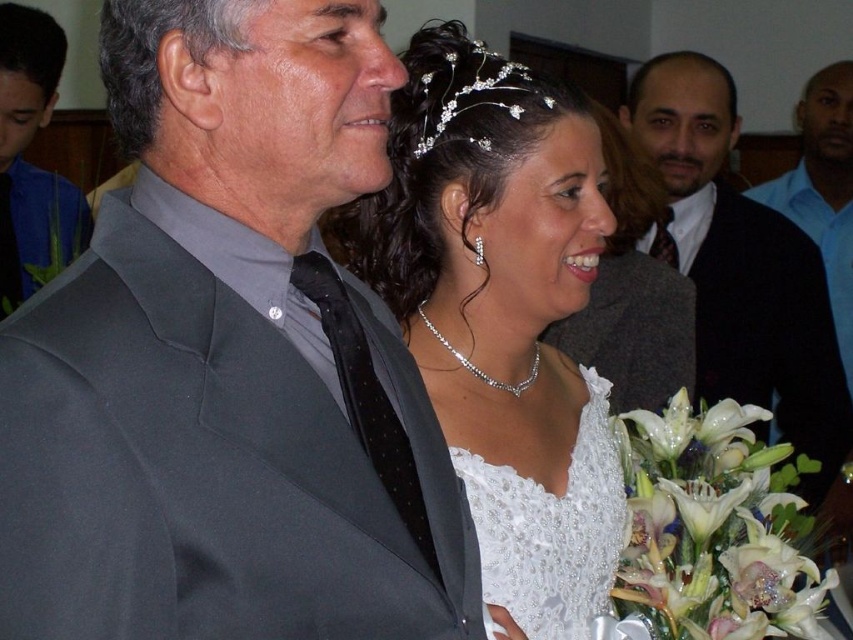
Question: Among these objects, which one is farthest from the camera?

Choices:
 (A) matte gray suit at left
 (B) smooth skin forehead at upper center
 (C) blue shirt at upper right
 (D) white satin dress at center

Answer: (C)

Question: Can you confirm if matte black suit at upper left is positioned to the right of matte gray suit at left?

Choices:
 (A) no
 (B) yes

Answer: (B)

Question: Does dark brown skin at upper right lie behind smooth skin face at upper left?

Choices:
 (A) yes
 (B) no

Answer: (B)

Question: Which point is farther from the camera taking this photo?

Choices:
 (A) (421, 259)
 (B) (819, 276)
 (C) (486, 51)
 (D) (693, 136)

Answer: (D)

Question: Which point appears farthest from the camera in this image?

Choices:
 (A) (51, 211)
 (B) (22, 100)

Answer: (A)

Question: Observing the image, what is the correct spatial positioning of pearl necklace at center in reference to blue shirt at upper right?

Choices:
 (A) below
 (B) above

Answer: (A)